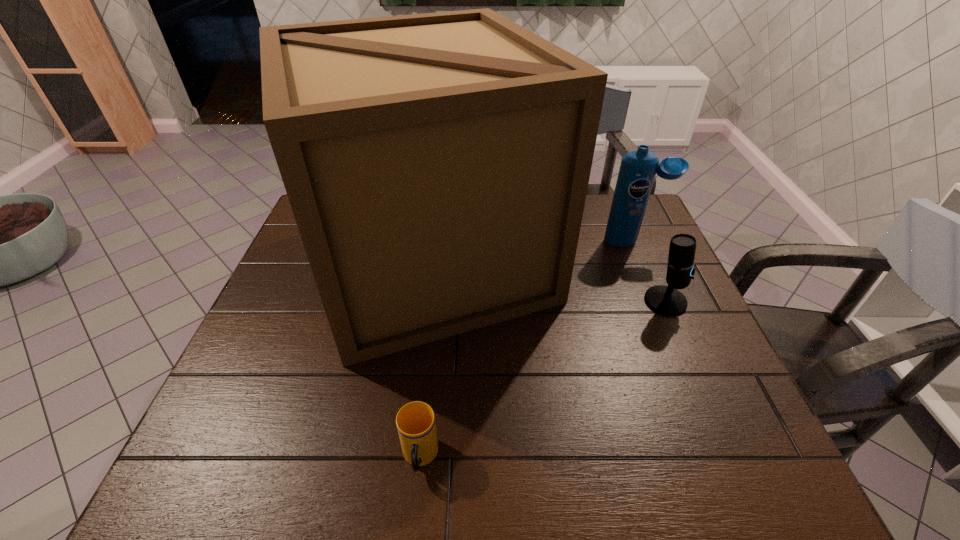
I want to click on box, so click(437, 165).

Find the location of a particular element. the third shortest object is located at coordinates (637, 171).

Where is `microphone`? microphone is located at coordinates (667, 300).

Identify the location of cup. Image resolution: width=960 pixels, height=540 pixels. (415, 421).

You are a GUI agent. You are given a task and a screenshot of the screen. Output one action in this format:
    pyautogui.click(x=<x>, y=<y>)
    Task: Click on the nearest object
    The width and height of the screenshot is (960, 540).
    Given the screenshot: What is the action you would take?
    pyautogui.click(x=415, y=421)

Identify the location of vacant space situated on the front of the tallest object. (409, 427).

Locate an element on the screen. blank area located 0.340m on the front of the shampoo is located at coordinates (671, 333).

This screenshot has height=540, width=960. Identify the location of vacant space located on the back of the microphone. (626, 211).

Find the location of `box positioned at the far edge`. box positioned at the far edge is located at coordinates (437, 165).

Locate an element on the screen. shampoo that is positioned at the far edge is located at coordinates (637, 171).